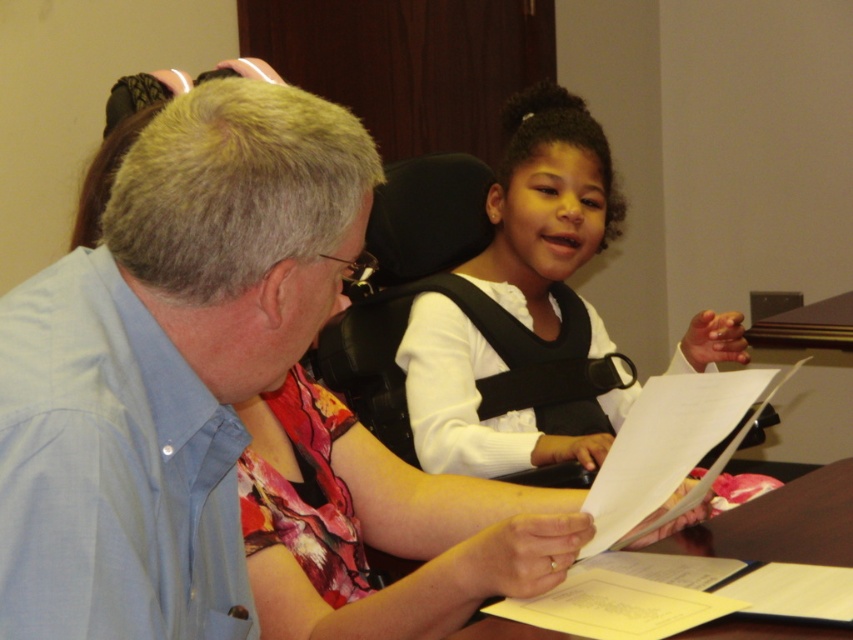
Is light blue shirt at left positioned behind brown wooden table at center?

No.

Who is lower down, light blue shirt at left or brown wooden table at center?

brown wooden table at center

Identify the location of light blue shirt at left. This screenshot has width=853, height=640. (167, 364).

At what (x,y) coordinates should I click in order to perform the action: click on light blue shirt at left. Please return your answer as a coordinate pair (x, y). Looking at the image, I should click on (167, 364).

Identify the location of white matte vest at center. (544, 208).

Does white matte vest at center have a lesser height compared to brown wooden table at center?

No.

Find the location of a particular element. white matte vest at center is located at coordinates (544, 208).

Image resolution: width=853 pixels, height=640 pixels. Find the location of `white matte vest at center`. white matte vest at center is located at coordinates (544, 208).

Can you confirm if light blue shirt at left is positioned to the right of white matte vest at center?

Incorrect, light blue shirt at left is not on the right side of white matte vest at center.

Does light blue shirt at left have a larger size compared to white matte vest at center?

Incorrect, light blue shirt at left is not larger than white matte vest at center.

What do you see at coordinates (167, 364) in the screenshot? The width and height of the screenshot is (853, 640). I see `light blue shirt at left` at bounding box center [167, 364].

At what (x,y) coordinates should I click in order to perform the action: click on light blue shirt at left. Please return your answer as a coordinate pair (x, y). Image resolution: width=853 pixels, height=640 pixels. Looking at the image, I should click on (167, 364).